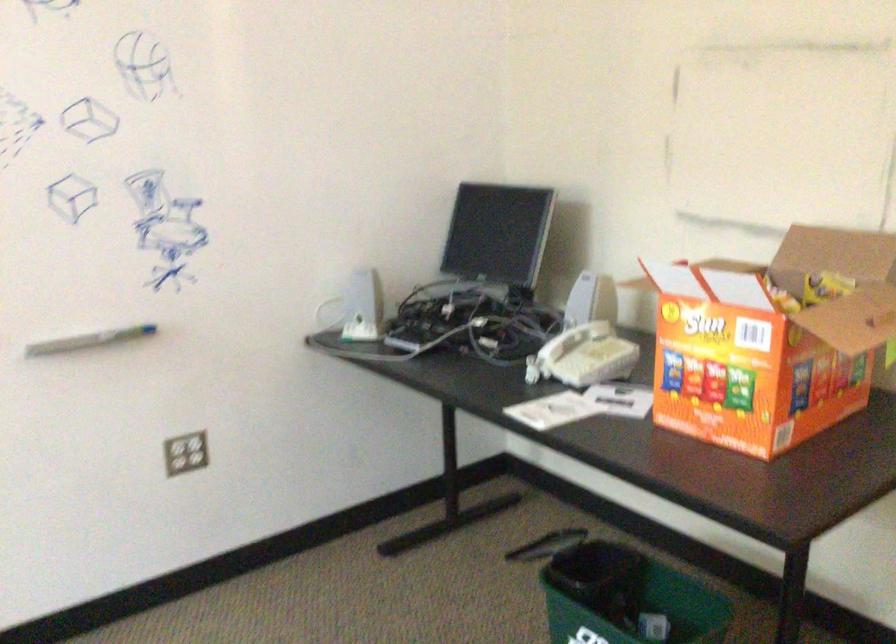
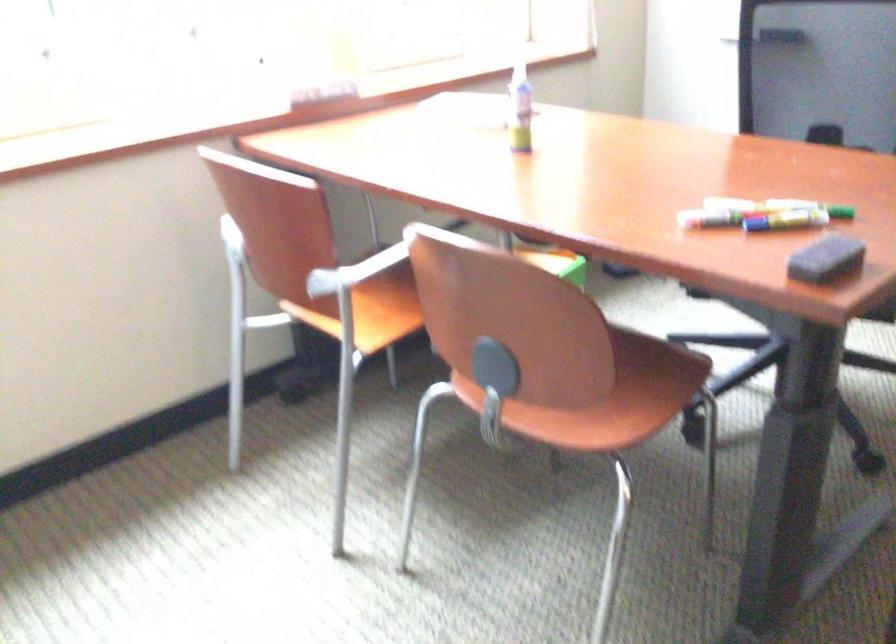
The images are taken continuously from a first-person perspective. In which direction is your viewpoint rotating?

The camera rotated toward left-down.